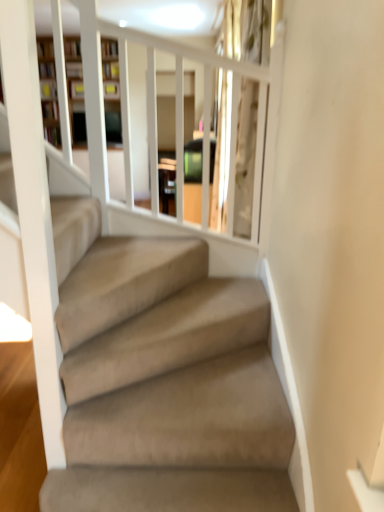
Question: Is clear glass door at upper center facing away from wooden bookshelf at upper left?

Choices:
 (A) no
 (B) yes

Answer: (A)

Question: Considering the relative positions of clear glass door at upper center and wooden bookshelf at upper left in the image provided, is clear glass door at upper center to the right of wooden bookshelf at upper left from the viewer's perspective?

Choices:
 (A) no
 (B) yes

Answer: (B)

Question: Would you say clear glass door at upper center is outside wooden bookshelf at upper left?

Choices:
 (A) yes
 (B) no

Answer: (A)

Question: Is clear glass door at upper center positioned in front of wooden bookshelf at upper left?

Choices:
 (A) no
 (B) yes

Answer: (B)

Question: From a real-world perspective, is clear glass door at upper center located higher than wooden bookshelf at upper left?

Choices:
 (A) yes
 (B) no

Answer: (B)

Question: From a real-world perspective, does clear glass door at upper center sit lower than wooden bookshelf at upper left?

Choices:
 (A) yes
 (B) no

Answer: (A)

Question: Is wooden bookshelf at upper left taller than clear glass door at upper center?

Choices:
 (A) no
 (B) yes

Answer: (B)

Question: Does wooden bookshelf at upper left come behind clear glass door at upper center?

Choices:
 (A) no
 (B) yes

Answer: (B)

Question: Is wooden bookshelf at upper left far from clear glass door at upper center?

Choices:
 (A) yes
 (B) no

Answer: (B)

Question: Does wooden bookshelf at upper left have a lesser width compared to clear glass door at upper center?

Choices:
 (A) no
 (B) yes

Answer: (A)

Question: Is wooden bookshelf at upper left positioned beyond the bounds of clear glass door at upper center?

Choices:
 (A) yes
 (B) no

Answer: (A)

Question: Is the position of wooden bookshelf at upper left less distant than that of clear glass door at upper center?

Choices:
 (A) yes
 (B) no

Answer: (B)

Question: Is point (49, 64) positioned closer to the camera than point (220, 172)?

Choices:
 (A) farther
 (B) closer

Answer: (B)